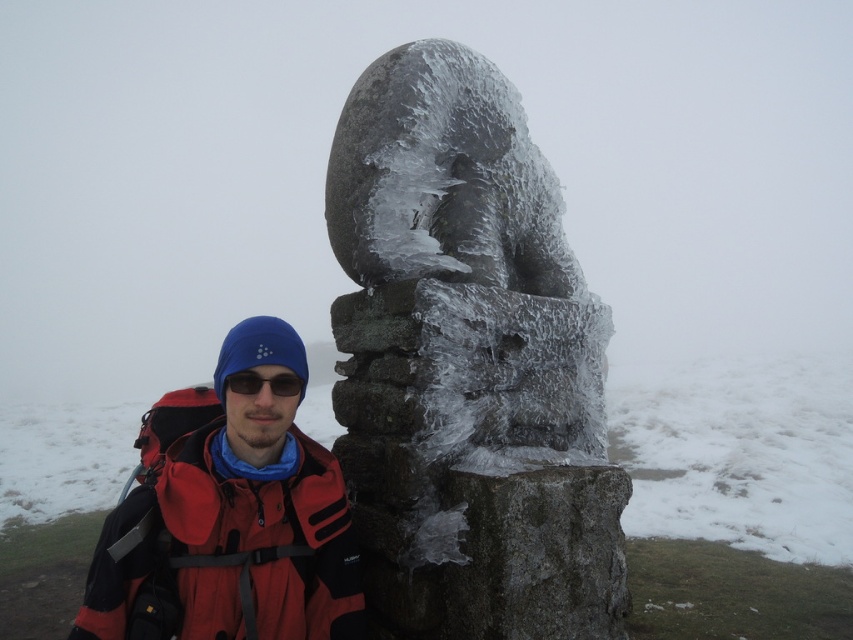
Does icy stone sculpture at center appear on the right side of white frosty snow at center?

Correct, you'll find icy stone sculpture at center to the right of white frosty snow at center.

Who is taller, icy stone sculpture at center or white frosty snow at center?

icy stone sculpture at center

Where is `icy stone sculpture at center`? This screenshot has width=853, height=640. icy stone sculpture at center is located at coordinates (467, 364).

Does white frosty snow at center lie behind black plastic goggles at center?

Yes.

Does white frosty snow at center appear on the right side of black plastic goggles at center?

Yes, white frosty snow at center is to the right of black plastic goggles at center.

This screenshot has width=853, height=640. Find the location of `white frosty snow at center`. white frosty snow at center is located at coordinates (740, 451).

In the scene shown: Can you confirm if icy stone sculpture at center is positioned above red matte jacket at lower left?

Yes.

Is icy stone sculpture at center below red matte jacket at lower left?

Incorrect, icy stone sculpture at center is not positioned below red matte jacket at lower left.

Image resolution: width=853 pixels, height=640 pixels. I want to click on icy stone sculpture at center, so click(x=467, y=364).